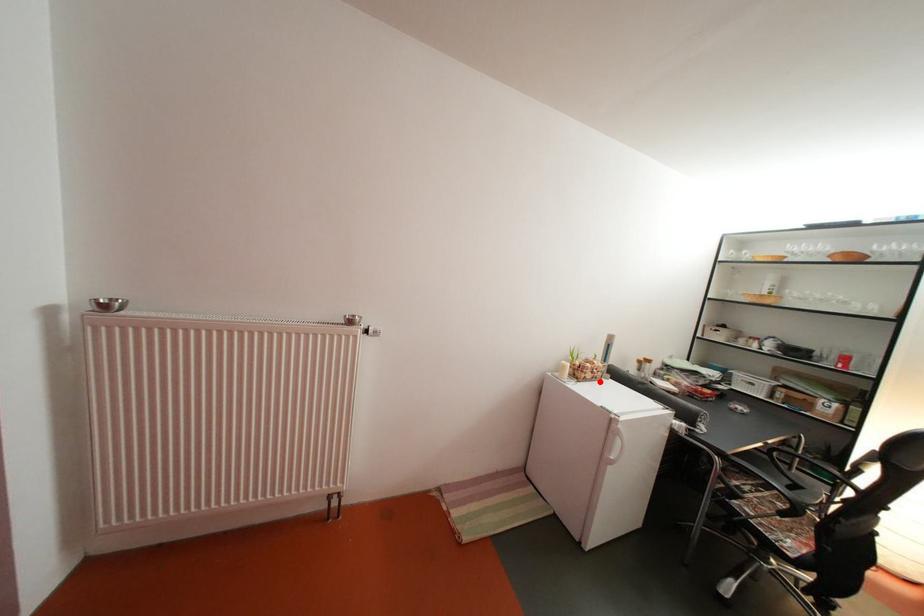
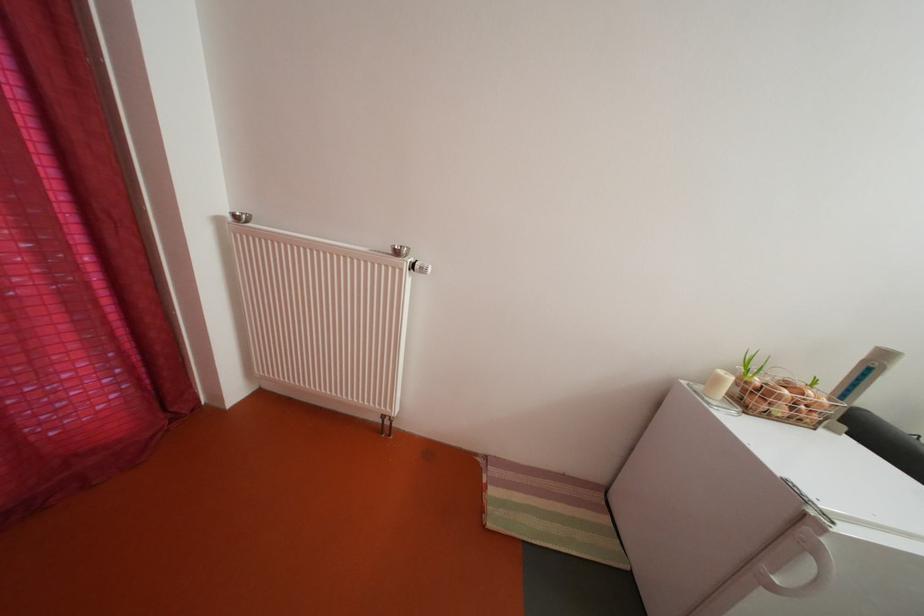
Locate, in the second image, the point that corresponds to the highlighted location in the first image.

(792, 416)